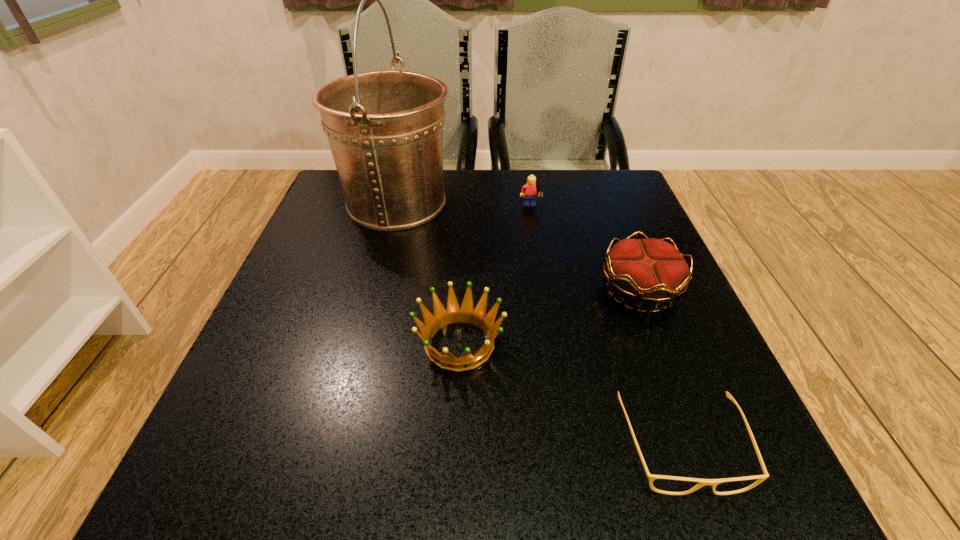
Locate an element on the screen. The height and width of the screenshot is (540, 960). bucket is located at coordinates (385, 128).

The width and height of the screenshot is (960, 540). I want to click on the second tallest object, so click(x=529, y=191).

This screenshot has width=960, height=540. Find the location of `Lego`. Lego is located at coordinates (529, 191).

This screenshot has height=540, width=960. Identify the location of the right crown. (650, 271).

You are a GUI agent. You are given a task and a screenshot of the screen. Output one action in this format:
    pyautogui.click(x=<x>, y=<y>)
    Task: Click on the left crown
    The height and width of the screenshot is (540, 960).
    Given the screenshot: What is the action you would take?
    pyautogui.click(x=454, y=313)

Locate an element on the screen. Image resolution: width=960 pixels, height=540 pixels. the nearest object is located at coordinates (702, 482).

Where is `the shortest object`? The image size is (960, 540). the shortest object is located at coordinates click(702, 482).

At what (x,y) coordinates should I click in order to perform the action: click on vacant area situated 0.300m on the front of the tallest object. Please return your answer as a coordinate pair (x, y). Looking at the image, I should click on (359, 352).

Find the location of a particular element. The width and height of the screenshot is (960, 540). blank space located 0.160m on the front-facing side of the third object from left to right is located at coordinates point(539,261).

At what (x,y) coordinates should I click in order to perform the action: click on free space located 0.170m on the front of the right crown. Please return your answer as a coordinate pair (x, y). This screenshot has width=960, height=540. Looking at the image, I should click on (684, 405).